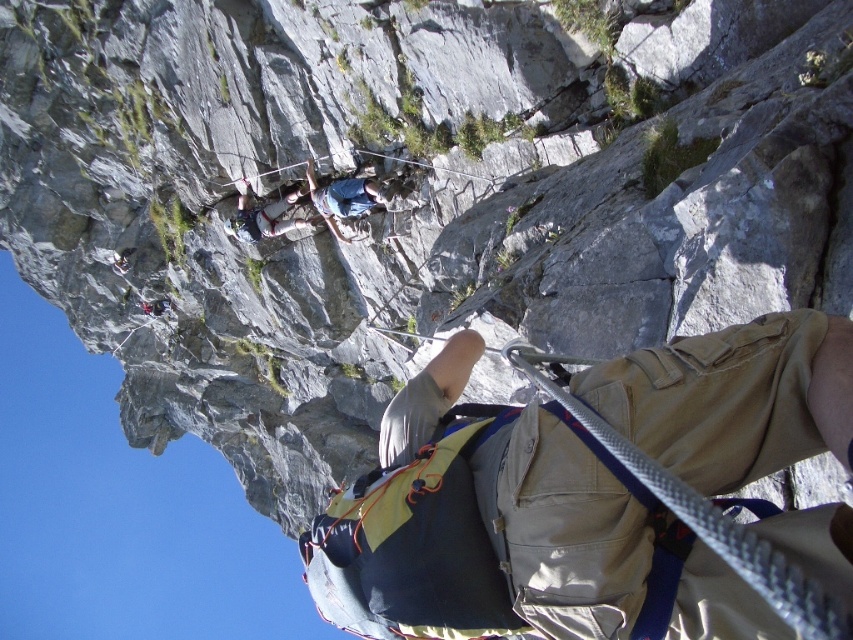
Question: Is tan fabric backpack at center below blue fabric shirt at upper center?

Choices:
 (A) yes
 (B) no

Answer: (A)

Question: Which point appears farthest from the camera in this image?

Choices:
 (A) (407, 412)
 (B) (386, 195)

Answer: (B)

Question: Which object is closer to the camera taking this photo?

Choices:
 (A) tan fabric backpack at center
 (B) blue fabric shirt at upper center

Answer: (A)

Question: Can you confirm if tan fabric backpack at center is bigger than blue fabric shirt at upper center?

Choices:
 (A) no
 (B) yes

Answer: (B)

Question: Is tan fabric backpack at center thinner than blue fabric shirt at upper center?

Choices:
 (A) yes
 (B) no

Answer: (B)